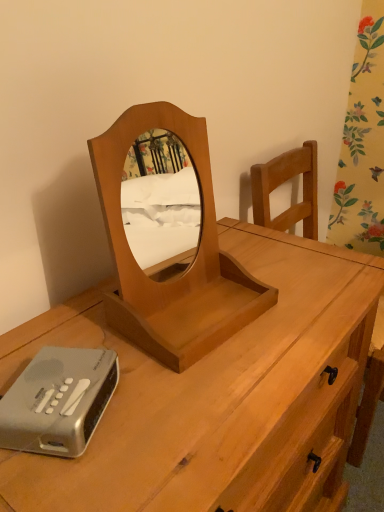
Question: Can you confirm if light brown wood mirror at center is thinner than light brown wood desk at center?

Choices:
 (A) no
 (B) yes

Answer: (B)

Question: Does light brown wood mirror at center have a smaller size compared to light brown wood desk at center?

Choices:
 (A) yes
 (B) no

Answer: (A)

Question: Considering the relative positions of light brown wood mirror at center and light brown wood desk at center in the image provided, is light brown wood mirror at center to the left of light brown wood desk at center from the viewer's perspective?

Choices:
 (A) yes
 (B) no

Answer: (A)

Question: Is light brown wood mirror at center looking in the opposite direction of light brown wood desk at center?

Choices:
 (A) yes
 (B) no

Answer: (B)

Question: Is light brown wood mirror at center far from light brown wood desk at center?

Choices:
 (A) yes
 (B) no

Answer: (B)

Question: Is silver plastic alarm clock at lower left spatially inside light brown wood mirror at center, or outside of it?

Choices:
 (A) outside
 (B) inside

Answer: (A)

Question: Considering the positions of silver plastic alarm clock at lower left and light brown wood mirror at center in the image, is silver plastic alarm clock at lower left taller or shorter than light brown wood mirror at center?

Choices:
 (A) tall
 (B) short

Answer: (B)

Question: Considering their positions, is silver plastic alarm clock at lower left located in front of or behind light brown wood mirror at center?

Choices:
 (A) front
 (B) behind

Answer: (B)

Question: Is point (109, 396) positioned closer to the camera than point (205, 249)?

Choices:
 (A) closer
 (B) farther

Answer: (A)

Question: Would you say silver plastic alarm clock at lower left is inside or outside light brown wood desk at center?

Choices:
 (A) outside
 (B) inside

Answer: (B)

Question: In terms of width, does silver plastic alarm clock at lower left look wider or thinner when compared to light brown wood desk at center?

Choices:
 (A) wide
 (B) thin

Answer: (B)

Question: Is silver plastic alarm clock at lower left to the left or to the right of light brown wood desk at center in the image?

Choices:
 (A) right
 (B) left

Answer: (B)

Question: From the image's perspective, is silver plastic alarm clock at lower left located above or below light brown wood desk at center?

Choices:
 (A) above
 (B) below

Answer: (A)

Question: Considering their positions, is light brown wood mirror at center located in front of or behind silver plastic alarm clock at lower left?

Choices:
 (A) behind
 (B) front

Answer: (B)

Question: Which is correct: light brown wood mirror at center is inside silver plastic alarm clock at lower left, or outside of it?

Choices:
 (A) outside
 (B) inside

Answer: (A)